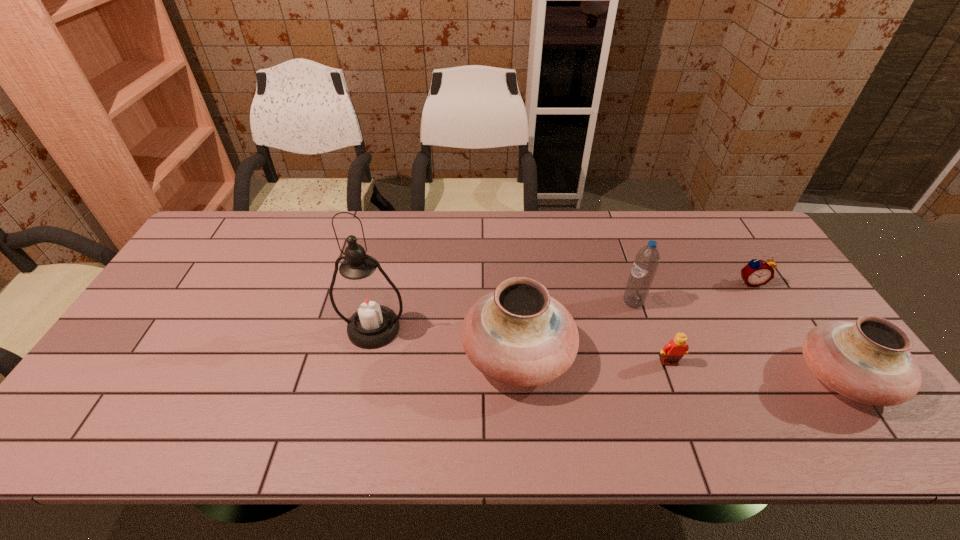
Find the location of a particular element. The image size is (960, 540). vacant region located on the back of the fourth tallest object is located at coordinates (781, 288).

Image resolution: width=960 pixels, height=540 pixels. Identify the location of free space located on the front-facing side of the alarm clock. (768, 310).

The height and width of the screenshot is (540, 960). Identify the location of vacant space located on the right of the water bottle. (733, 302).

Where is `vacant space located 0.140m on the back of the oil lamp`? vacant space located 0.140m on the back of the oil lamp is located at coordinates (385, 275).

The image size is (960, 540). Find the location of `vacant space situated on the face of the Lego`. vacant space situated on the face of the Lego is located at coordinates (680, 391).

Where is `pottery positioned at the right edge`? Image resolution: width=960 pixels, height=540 pixels. pottery positioned at the right edge is located at coordinates (868, 361).

You are a GUI agent. You are given a task and a screenshot of the screen. Output one action in this format:
    pyautogui.click(x=<x>, y=<y>)
    Task: Click on the alarm clock present at the right edge
    This screenshot has height=540, width=960.
    Given the screenshot: What is the action you would take?
    tap(756, 273)

Identify the location of object that is positioned at the near right corner. (868, 361).

Locate an element on the screen. free location at the far edge of the desktop is located at coordinates (285, 220).

The width and height of the screenshot is (960, 540). What are the coordinates of `free space at the near edge of the desktop` in the screenshot? It's located at (776, 408).